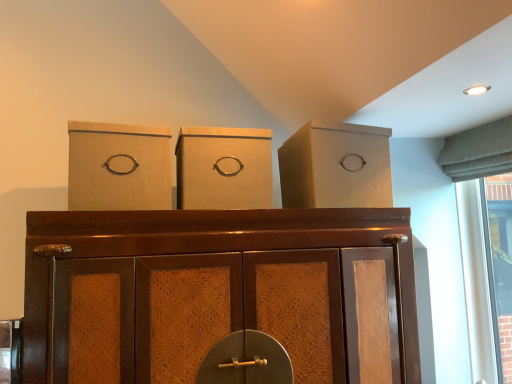
What do you see at coordinates (220, 295) in the screenshot? This screenshot has height=384, width=512. I see `brown wood cupboard at center` at bounding box center [220, 295].

You are a GUI agent. You are given a task and a screenshot of the screen. Output one action in this format:
    pyautogui.click(x=<x>, y=<y>)
    Task: Click on the matte cardboard box at left, the first cardboard box from the left
    The width and height of the screenshot is (512, 384).
    Given the screenshot: What is the action you would take?
    pyautogui.click(x=118, y=167)

The image size is (512, 384). What do you see at coordinates (224, 168) in the screenshot?
I see `matte cardboard box at center, the second cardboard box in the left-to-right sequence` at bounding box center [224, 168].

What is the approximate height of matte cardboard box at center, the second cardboard box in the left-to-right sequence?

10.81 inches.

You are a GUI agent. You are given a task and a screenshot of the screen. Output one action in this format:
    pyautogui.click(x=<x>, y=<y>)
    Task: Click on the matte cardboard box at upper right
    
    Given the screenshot: What is the action you would take?
    pyautogui.click(x=336, y=166)

From a real-world perspective, between matte cardboard box at left, the 2th cardboard box in the right-to-left sequence, and brown wood cupboard at center, who is vertically lower?

brown wood cupboard at center.

In the scene shown: How distant is matte cardboard box at left, the first cardboard box from the left, from brown wood cupboard at center?

matte cardboard box at left, the first cardboard box from the left, is 13.36 inches from brown wood cupboard at center.

In terms of size, does matte cardboard box at left, the first cardboard box from the left, appear bigger or smaller than brown wood cupboard at center?

Considering their sizes, matte cardboard box at left, the first cardboard box from the left, takes up less space than brown wood cupboard at center.

Based on the photo, is matte cardboard box at left, the 2th cardboard box in the right-to-left sequence, at the left side of brown wood cupboard at center?

Yes.

Considering the sizes of objects brown wood cupboard at center and matte cardboard box at center, the second cardboard box in the left-to-right sequence, in the image provided, who is thinner, brown wood cupboard at center or matte cardboard box at center, the second cardboard box in the left-to-right sequence,?

Thinner between the two is matte cardboard box at center, the second cardboard box in the left-to-right sequence.

Based on the photo, how many degrees apart are the facing directions of brown wood cupboard at center and matte cardboard box at center, which appears as the first cardboard box when viewed from the right?

The facing directions of brown wood cupboard at center and matte cardboard box at center, which appears as the first cardboard box when viewed from the right, are 0.091 degrees apart.

Which of these two, brown wood cupboard at center or matte cardboard box at center, which appears as the first cardboard box when viewed from the right, stands taller?

brown wood cupboard at center.

Considering the points (32, 260) and (191, 208), which point is in front, point (32, 260) or point (191, 208)?

The point (32, 260) is more forward.

Identify the location of cupboard below the matte cardboard box at center, which appears as the first cardboard box when viewed from the right (from the image's perspective). This screenshot has width=512, height=384. (220, 295).

Is brown wood cupboard at center at the back of matte cardboard box at center, the second cardboard box in the left-to-right sequence?

No, matte cardboard box at center, the second cardboard box in the left-to-right sequence, is not facing away from brown wood cupboard at center.

Would you consider matte cardboard box at center, which appears as the first cardboard box when viewed from the right, to be distant from brown wood cupboard at center?

matte cardboard box at center, which appears as the first cardboard box when viewed from the right, is actually quite close to brown wood cupboard at center.

Which object is positioned more to the left, matte cardboard box at center, which appears as the first cardboard box when viewed from the right, or brown wood cupboard at center?

matte cardboard box at center, which appears as the first cardboard box when viewed from the right.

From a real-world perspective, is matte cardboard box at center, which appears as the first cardboard box when viewed from the right, over matte cardboard box at upper right?

No, from a real-world perspective, matte cardboard box at center, which appears as the first cardboard box when viewed from the right, is not over matte cardboard box at upper right

Which of these two, matte cardboard box at center, the second cardboard box in the left-to-right sequence, or matte cardboard box at upper right, is smaller?

With smaller size is matte cardboard box at center, the second cardboard box in the left-to-right sequence.

Consider the image. Is matte cardboard box at center, the second cardboard box in the left-to-right sequence, surrounding matte cardboard box at upper right?

Definitely not — matte cardboard box at upper right is not inside matte cardboard box at center, the second cardboard box in the left-to-right sequence.

Is matte cardboard box at upper right inside the boundaries of brown wood cupboard at center, or outside?

matte cardboard box at upper right is not inside brown wood cupboard at center, it's outside.

Is matte cardboard box at upper right facing away from brown wood cupboard at center?

No, matte cardboard box at upper right is not facing away from brown wood cupboard at center.

Consider the image. Measure the distance between matte cardboard box at upper right and brown wood cupboard at center.

13.20 inches.

From the image's perspective, is matte cardboard box at upper right located above or below brown wood cupboard at center?

From the image's perspective, matte cardboard box at upper right appears above brown wood cupboard at center.

Are matte cardboard box at left, the 2th cardboard box in the right-to-left sequence, and matte cardboard box at upper right far apart?

No, matte cardboard box at left, the 2th cardboard box in the right-to-left sequence, is not far away from matte cardboard box at upper right.

Is matte cardboard box at left, the first cardboard box from the left, shorter than matte cardboard box at upper right?

Indeed, matte cardboard box at left, the first cardboard box from the left, has a lesser height compared to matte cardboard box at upper right.

Considering the sizes of objects matte cardboard box at left, the first cardboard box from the left, and matte cardboard box at upper right in the image provided, who is bigger, matte cardboard box at left, the first cardboard box from the left, or matte cardboard box at upper right?

matte cardboard box at upper right is bigger.

Considering the sizes of brown wood cupboard at center and matte cardboard box at upper right in the image, is brown wood cupboard at center bigger or smaller than matte cardboard box at upper right?

brown wood cupboard at center is bigger than matte cardboard box at upper right.

Which object is closer to the camera, brown wood cupboard at center or matte cardboard box at upper right?

brown wood cupboard at center is closer to the camera.

From the image's perspective, is brown wood cupboard at center located above or below matte cardboard box at upper right?

Clearly, from the image's perspective, brown wood cupboard at center is below matte cardboard box at upper right.

Is brown wood cupboard at center outside of matte cardboard box at upper right?

Yes, brown wood cupboard at center is outside of matte cardboard box at upper right.

Identify the location of the 2nd cardboard box positioned above the brown wood cupboard at center (from the image's perspective). This screenshot has height=384, width=512. (118, 167).

Locate an element on the screen. This screenshot has height=384, width=512. cupboard in front of the matte cardboard box at center, the second cardboard box in the left-to-right sequence is located at coordinates (220, 295).

Based on their spatial positions, is matte cardboard box at center, the second cardboard box in the left-to-right sequence, or matte cardboard box at left, the first cardboard box from the left, closer to brown wood cupboard at center?

matte cardboard box at center, the second cardboard box in the left-to-right sequence.

From the image, which object appears to be nearer to matte cardboard box at left, the first cardboard box from the left, brown wood cupboard at center or matte cardboard box at upper right?

The object closer to matte cardboard box at left, the first cardboard box from the left, is brown wood cupboard at center.

When comparing their distances from matte cardboard box at center, the second cardboard box in the left-to-right sequence, does brown wood cupboard at center or matte cardboard box at left, the first cardboard box from the left, seem closer?

matte cardboard box at left, the first cardboard box from the left, is closer to matte cardboard box at center, the second cardboard box in the left-to-right sequence.

Based on their spatial positions, is brown wood cupboard at center or matte cardboard box at left, the first cardboard box from the left, closer to matte cardboard box at upper right?

Among the two, brown wood cupboard at center is located nearer to matte cardboard box at upper right.

From the image, which object appears to be farther from matte cardboard box at left, the 2th cardboard box in the right-to-left sequence, matte cardboard box at center, which appears as the first cardboard box when viewed from the right, or matte cardboard box at upper right?

matte cardboard box at upper right.

Looking at this image, when comparing their distances from brown wood cupboard at center, does matte cardboard box at center, which appears as the first cardboard box when viewed from the right, or matte cardboard box at upper right seem further?

matte cardboard box at upper right is positioned further to the anchor brown wood cupboard at center.

Considering their positions, is matte cardboard box at upper right positioned further to brown wood cupboard at center than matte cardboard box at center, which appears as the first cardboard box when viewed from the right?

Among the two, matte cardboard box at upper right is located further to brown wood cupboard at center.

Looking at the image, which one is located closer to matte cardboard box at left, the first cardboard box from the left, matte cardboard box at upper right or brown wood cupboard at center?

brown wood cupboard at center.

Where is `cardboard box between matte cardboard box at left, the 2th cardboard box in the right-to-left sequence, and matte cardboard box at upper right from left to right`? The height and width of the screenshot is (384, 512). cardboard box between matte cardboard box at left, the 2th cardboard box in the right-to-left sequence, and matte cardboard box at upper right from left to right is located at coordinates (224, 168).

The image size is (512, 384). I want to click on cardboard box between matte cardboard box at left, the first cardboard box from the left, and brown wood cupboard at center vertically, so click(224, 168).

Locate an element on the screen. This screenshot has width=512, height=384. cupboard between matte cardboard box at left, the 2th cardboard box in the right-to-left sequence, and matte cardboard box at upper right from left to right is located at coordinates (220, 295).